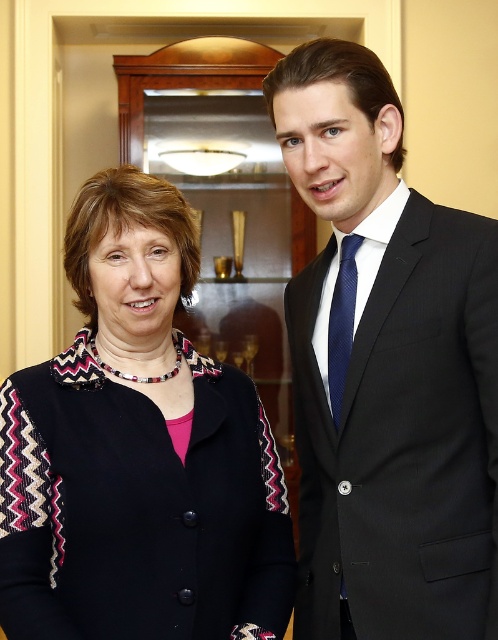
From the picture: You are a photographer at a formal event. You need to adjust the lighting so that the black suit at right and the navy silk tie at right are both visible. Which object should you focus on first to ensure proper exposure?

The black suit at right is below navy silk tie at right, so you should focus on the navy silk tie at right first to ensure proper exposure since it is higher up and might be in a different lighting area.

You are organizing a clothing donation drive and need to sort items by size. You have a black knitted sweater at center and a navy silk tie at right. Which item should you place in the large items bin?

The black knitted sweater at center should be placed in the large items bin because it is larger in size than the navy silk tie at right.

You are standing in the center of the room and want to move towards the black suit at right. What direction should you move in to reach it?

Since the black suit at right is located at point 0.578 on the x axis and 0.777 on the y axis, you should move towards the right and slightly forward to reach it.